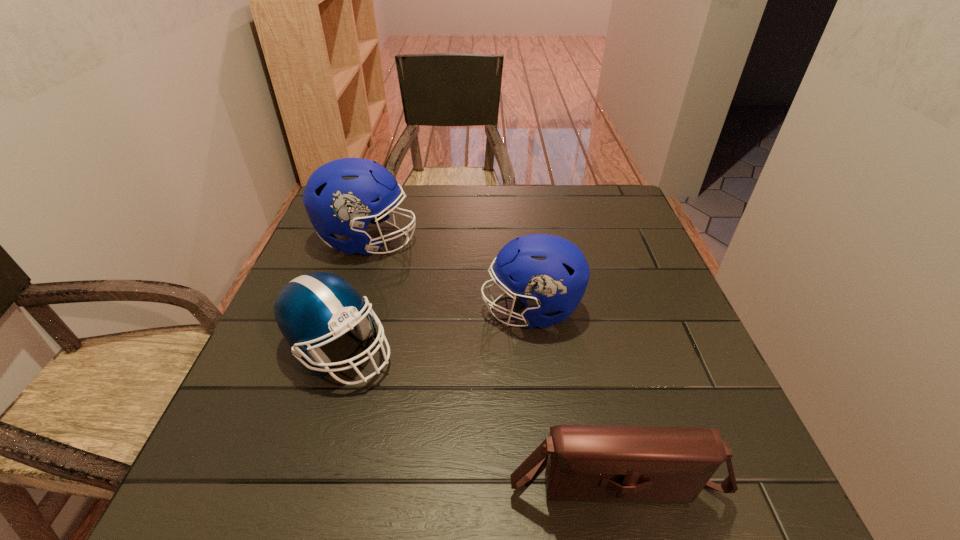
Where is `the tallest football helmet`? The height and width of the screenshot is (540, 960). the tallest football helmet is located at coordinates (341, 197).

Where is `the tallest object`? the tallest object is located at coordinates (341, 197).

Where is `the rightmost football helmet`? the rightmost football helmet is located at coordinates (548, 273).

I want to click on the nearest object, so click(x=641, y=464).

Image resolution: width=960 pixels, height=540 pixels. I want to click on free space located on the face guard of the tallest object, so click(x=544, y=241).

Find the location of `free space located on the front-facing side of the rightmost football helmet`. free space located on the front-facing side of the rightmost football helmet is located at coordinates (459, 310).

Image resolution: width=960 pixels, height=540 pixels. I want to click on free spot located on the front-facing side of the rightmost football helmet, so click(445, 310).

Identify the location of free spot located on the front-facing side of the rightmost football helmet. (x=400, y=310).

The height and width of the screenshot is (540, 960). In order to click on object positioned at the far edge in this screenshot , I will do `click(341, 197)`.

The width and height of the screenshot is (960, 540). Find the location of `object that is at the near edge`. object that is at the near edge is located at coordinates (641, 464).